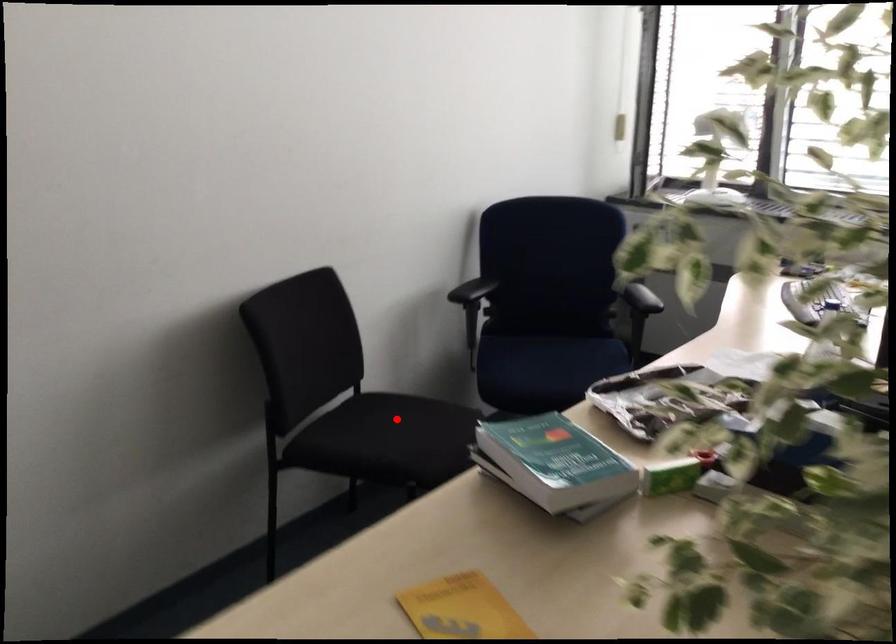
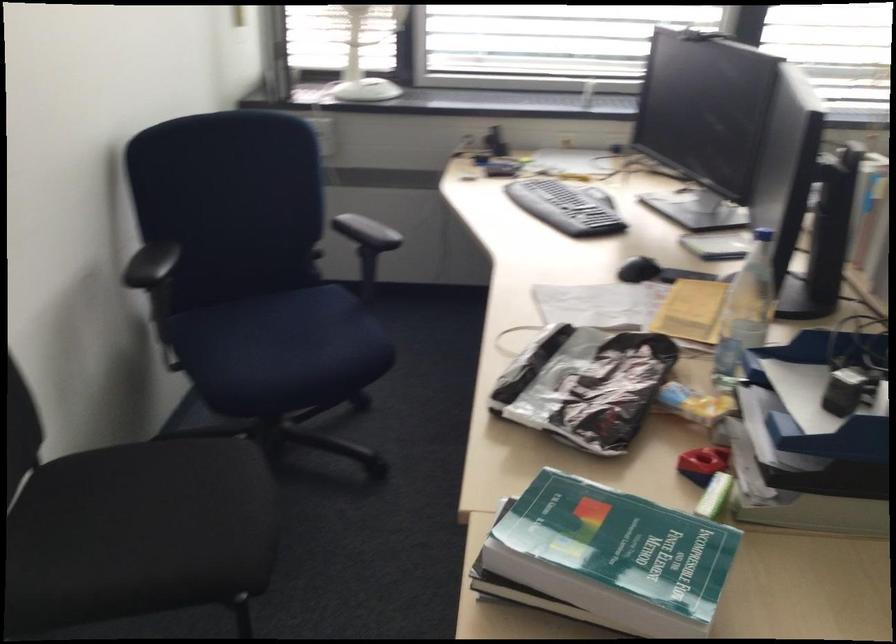
Find the pixel in the second image that matches the highlighted location in the first image.

(157, 500)